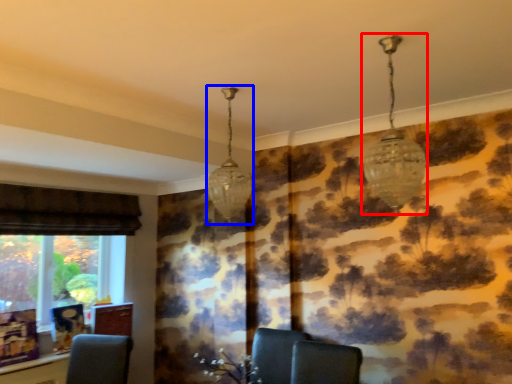
Question: Which object is closer to the camera taking this photo, lamp (highlighted by a red box) or lamp (highlighted by a blue box)?

Choices:
 (A) lamp
 (B) lamp

Answer: (A)